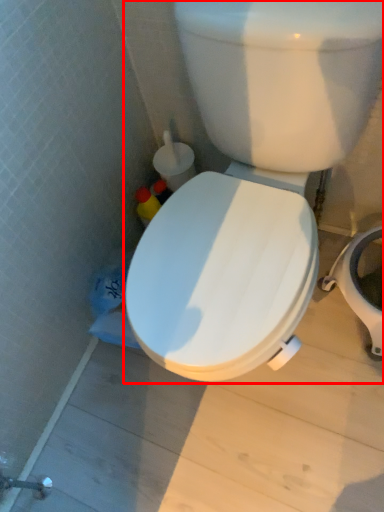
Question: Considering the relative positions of toilet (annotated by the red box) and bidet in the image provided, where is toilet (annotated by the red box) located with respect to the staircase?

Choices:
 (A) right
 (B) left

Answer: (B)